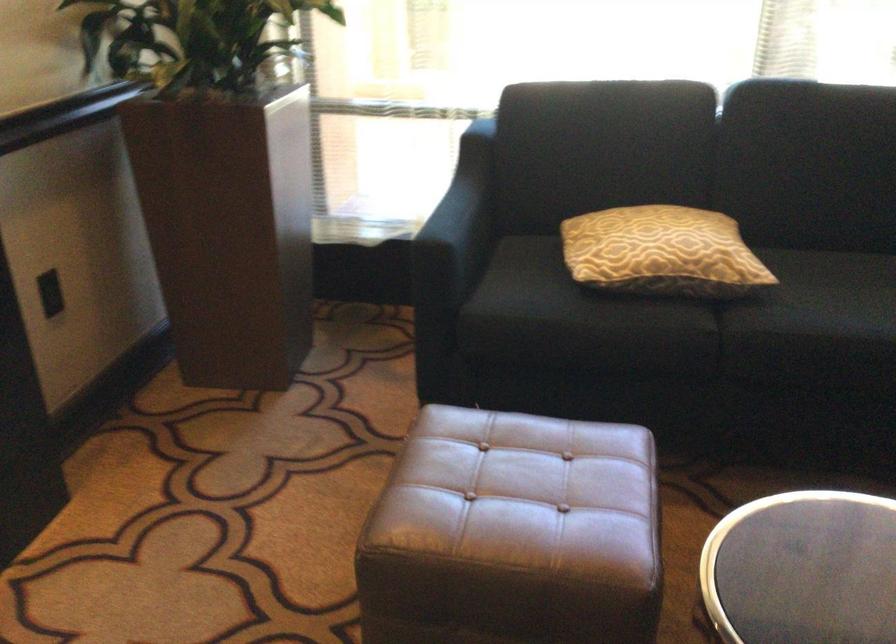
What do you see at coordinates (752, 289) in the screenshot? The height and width of the screenshot is (644, 896). I see `the sofa sitting surface` at bounding box center [752, 289].